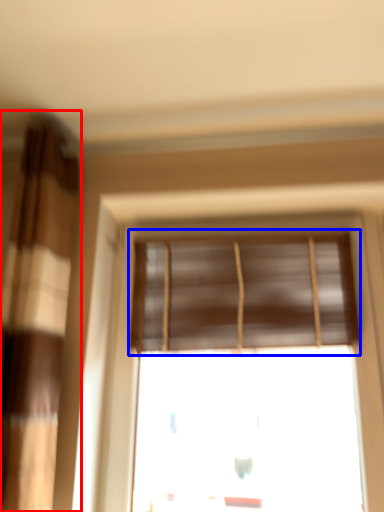
Question: Which point is further to the camera, curtain (highlighted by a red box) or window blind (highlighted by a blue box)?

Choices:
 (A) curtain
 (B) window blind

Answer: (B)